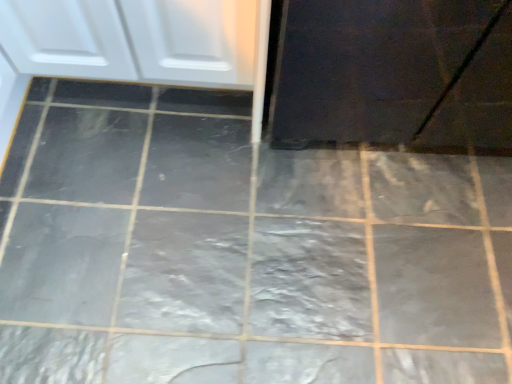
Measure the distance between white glossy cabinet at upper left and camera.

They are 34.91 inches apart.

Find the location of `white glossy cabinet at upper left`. white glossy cabinet at upper left is located at coordinates point(136,39).

Image resolution: width=512 pixels, height=384 pixels. What do you see at coordinates (136, 39) in the screenshot?
I see `white glossy cabinet at upper left` at bounding box center [136, 39].

At what (x,y) coordinates should I click in order to perform the action: click on white glossy cabinet at upper left. Please return your answer as a coordinate pair (x, y). Image resolution: width=512 pixels, height=384 pixels. Looking at the image, I should click on (136, 39).